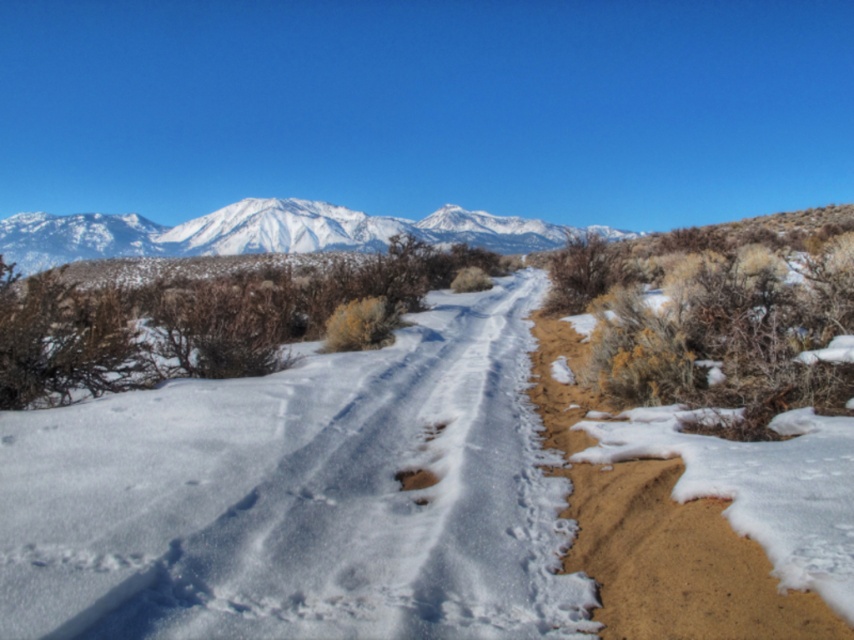
Question: Considering the relative positions of brown sandy dirt track at right and brown dirt footprint at center in the image provided, where is brown sandy dirt track at right located with respect to brown dirt footprint at center?

Choices:
 (A) right
 (B) left

Answer: (A)

Question: Is brown sandy dirt track at right further to camera compared to snowy white mountain range at upper center?

Choices:
 (A) yes
 (B) no

Answer: (B)

Question: Which of the following is the farthest from the observer?

Choices:
 (A) snowy white mountain range at upper center
 (B) brown dirt footprint at center

Answer: (A)

Question: Is brown sandy dirt track at right to the left of brown dirt footprint at center from the viewer's perspective?

Choices:
 (A) yes
 (B) no

Answer: (B)

Question: Considering the real-world distances, which object is closest to the brown sandy dirt track at right?

Choices:
 (A) snowy white mountain range at upper center
 (B) brown dirt footprint at center

Answer: (B)

Question: Which point appears farthest from the camera in this image?

Choices:
 (A) (702, 612)
 (B) (404, 486)

Answer: (B)